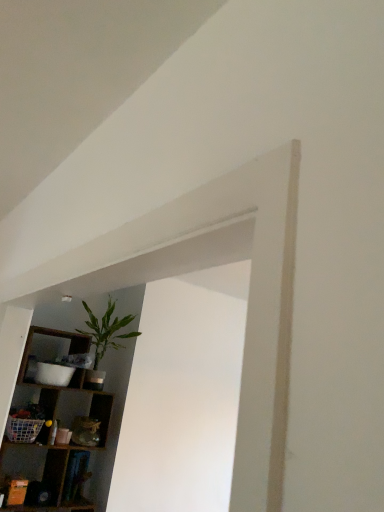
Image resolution: width=384 pixels, height=512 pixels. Describe the element at coordinates (69, 385) in the screenshot. I see `wooden shelf at left` at that location.

At what (x,y) coordinates should I click in order to perform the action: click on wooden shelf at left. Please return your answer as a coordinate pair (x, y). Image resolution: width=384 pixels, height=512 pixels. Looking at the image, I should click on (69, 385).

Locate an element on the screen. green leafy plant at upper left is located at coordinates (104, 339).

Describe the element at coordinates (104, 339) in the screenshot. I see `green leafy plant at upper left` at that location.

The image size is (384, 512). I want to click on wooden shelf at left, so [x=69, y=385].

Which object is positioned more to the right, green leafy plant at upper left or wooden shelf at left?

green leafy plant at upper left is more to the right.

Considering the positions of objects green leafy plant at upper left and wooden shelf at left in the image provided, who is in front, green leafy plant at upper left or wooden shelf at left?

wooden shelf at left is in front.

Considering the points (112, 334) and (89, 339), which point is in front, point (112, 334) or point (89, 339)?

The point (89, 339) is closer to the camera.

From the image's perspective, which object appears higher, green leafy plant at upper left or wooden shelf at left?

green leafy plant at upper left appears higher in the image.

From a real-world perspective, is green leafy plant at upper left below wooden shelf at left?

Actually, green leafy plant at upper left is physically above wooden shelf at left in the real world.

Consider the image. Considering the relative sizes of green leafy plant at upper left and wooden shelf at left in the image provided, is green leafy plant at upper left thinner than wooden shelf at left?

Indeed, green leafy plant at upper left has a lesser width compared to wooden shelf at left.

Which of these two, green leafy plant at upper left or wooden shelf at left, stands shorter?

Standing shorter between the two is green leafy plant at upper left.

Looking at the image, does green leafy plant at upper left seem bigger or smaller compared to wooden shelf at left?

In the image, green leafy plant at upper left appears to be smaller than wooden shelf at left.

Would you say green leafy plant at upper left is outside wooden shelf at left?

No, green leafy plant at upper left is not entirely external to wooden shelf at left.

Is green leafy plant at upper left in contact with wooden shelf at left?

No, green leafy plant at upper left is not next to wooden shelf at left.

Does green leafy plant at upper left turn towards wooden shelf at left?

Yes, green leafy plant at upper left is aimed at wooden shelf at left.

Measure the distance between green leafy plant at upper left and wooden shelf at left.

green leafy plant at upper left and wooden shelf at left are 14.72 inches apart.

Where is `shelf on the left of green leafy plant at upper left`? The width and height of the screenshot is (384, 512). shelf on the left of green leafy plant at upper left is located at coordinates (69, 385).

Which is more to the left, wooden shelf at left or green leafy plant at upper left?

From the viewer's perspective, wooden shelf at left appears more on the left side.

Who is more distant, wooden shelf at left or green leafy plant at upper left?

green leafy plant at upper left is more distant.

Between point (100, 496) and point (93, 367), which one is positioned in front?

The point (100, 496) is closer to the camera.

From the image's perspective, between wooden shelf at left and green leafy plant at upper left, who is located below?

wooden shelf at left appears lower in the image.

From a real-world perspective, does wooden shelf at left sit lower than green leafy plant at upper left?

Correct, in the physical world, wooden shelf at left is lower than green leafy plant at upper left.

Is wooden shelf at left thinner than green leafy plant at upper left?

In fact, wooden shelf at left might be wider than green leafy plant at upper left.

Does wooden shelf at left have a greater height compared to green leafy plant at upper left?

Answer: Yes, wooden shelf at left is taller than green leafy plant at upper left.

Who is bigger, wooden shelf at left or green leafy plant at upper left?

Bigger between the two is wooden shelf at left.

Is green leafy plant at upper left completely or partially inside wooden shelf at left?

No, wooden shelf at left does not contain green leafy plant at upper left.

Is wooden shelf at left beside green leafy plant at upper left?

No, wooden shelf at left is not in contact with green leafy plant at upper left.

Is wooden shelf at left facing away from green leafy plant at upper left?

No, wooden shelf at left is not facing away from green leafy plant at upper left.

How much distance is there between wooden shelf at left and green leafy plant at upper left?

wooden shelf at left is 14.72 inches away from green leafy plant at upper left.

Where is `houseplant located above the wooden shelf at left (from a real-world perspective)`? Image resolution: width=384 pixels, height=512 pixels. houseplant located above the wooden shelf at left (from a real-world perspective) is located at coordinates (104, 339).

Where is `shelf in front of the green leafy plant at upper left`? shelf in front of the green leafy plant at upper left is located at coordinates (69, 385).

I want to click on houseplant above the wooden shelf at left (from a real-world perspective), so click(104, 339).